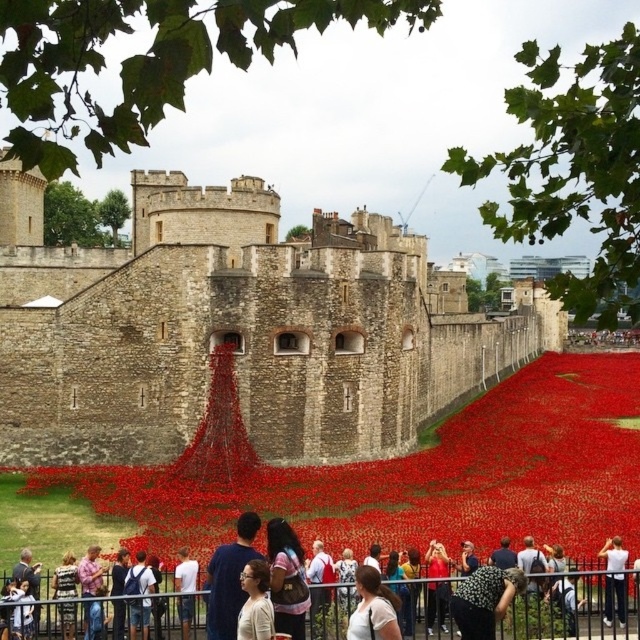
Question: Is metallic silver fence at lower center bigger than white cotton shirt at lower right?

Choices:
 (A) yes
 (B) no

Answer: (A)

Question: Can you confirm if white cotton shirt at center is positioned above denim jacket at lower left?

Choices:
 (A) yes
 (B) no

Answer: (A)

Question: Which of the following is the closest to the observer?

Choices:
 (A) matte red poppy field at center
 (B) red fabric dress at center

Answer: (B)

Question: Can you confirm if stone wall at center is bigger than white cotton shirt at lower right?

Choices:
 (A) yes
 (B) no

Answer: (A)

Question: Which of the following is the closest to the observer?

Choices:
 (A) (346, 248)
 (B) (432, 580)

Answer: (B)

Question: Which object is the closest to the white matte shirt at lower center?

Choices:
 (A) matte red poppy field at center
 (B) metallic silver fence at lower center
 (C) pink cotton shirt at lower left

Answer: (B)